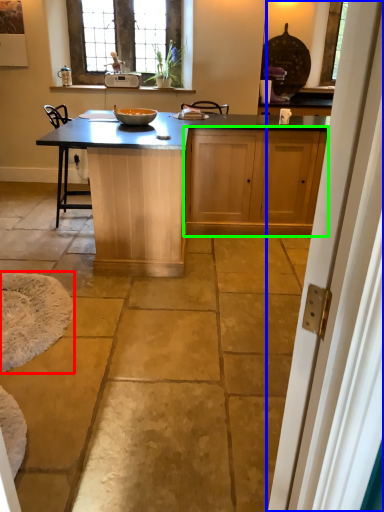
Question: Estimate the real-world distances between objects in this image. Which object is closer to wide (highlighted by a red box), screen door (highlighted by a blue box) or cabinetry (highlighted by a green box)?

Choices:
 (A) screen door
 (B) cabinetry

Answer: (B)